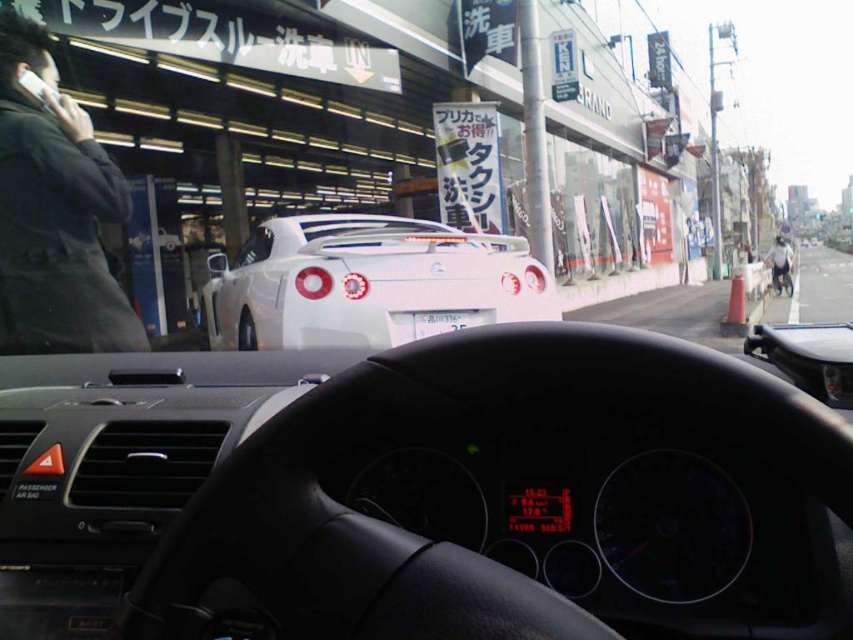
Can you confirm if white glossy sports car at center is smaller than light gray fabric jacket at right?

Yes.

Is white glossy sports car at center to the right of light gray fabric jacket at right from the viewer's perspective?

Incorrect, white glossy sports car at center is not on the right side of light gray fabric jacket at right.

Is point (451, 307) positioned in front of point (788, 252)?

Yes.

I want to click on white glossy sports car at center, so click(364, 282).

Is point (207, 256) positioned behind point (28, 88)?

Yes, point (207, 256) is farther from viewer.

Who is taller, white glossy sports car at center or black plastic phone at upper left?

white glossy sports car at center is taller.

Who is more forward, (445, 308) or (55, 92)?

Point (55, 92)

Where is `white glossy sports car at center`? white glossy sports car at center is located at coordinates (364, 282).

This screenshot has width=853, height=640. Describe the element at coordinates (54, 214) in the screenshot. I see `black fabric jacket at left` at that location.

Between point (111, 188) and point (779, 248), which one is positioned behind?

The point (779, 248) is more distant.

Who is more distant from viewer, (59,157) or (781,259)?

Positioned behind is point (781,259).

You are a GUI agent. You are given a task and a screenshot of the screen. Output one action in this format:
    pyautogui.click(x=<x>, y=<y>)
    Task: Click on the black fabric jacket at left
    The width and height of the screenshot is (853, 640).
    Given the screenshot: What is the action you would take?
    point(54,214)